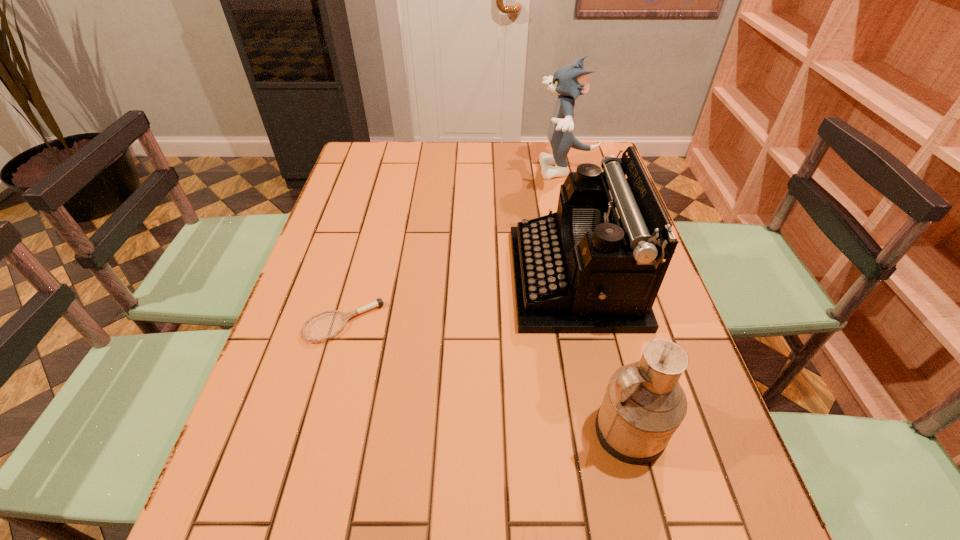
Find the location of `vacant space situated 0.230m on the typing side of the typewriter`. vacant space situated 0.230m on the typing side of the typewriter is located at coordinates (423, 278).

Find the location of a particular element. vacant space located on the typing side of the typewriter is located at coordinates (399, 278).

In order to click on free space located on the left of the nearest object in this screenshot , I will do `click(565, 430)`.

At what (x,y) coordinates should I click in order to perform the action: click on blank space located on the front of the leftmost object. Please return your answer as a coordinate pair (x, y). Looking at the image, I should click on (296, 492).

This screenshot has height=540, width=960. Identify the location of object located in the far edge section of the desktop. (568, 82).

In order to click on object at the left edge in this screenshot , I will do `click(379, 302)`.

This screenshot has width=960, height=540. In order to click on cat at the right edge in this screenshot , I will do `click(568, 82)`.

Image resolution: width=960 pixels, height=540 pixels. Find the location of `typewriter at the right edge`. typewriter at the right edge is located at coordinates (596, 265).

Locate an element on the screen. pitcher at the right edge is located at coordinates (644, 404).

In order to click on object present at the far right corner in this screenshot , I will do `click(568, 82)`.